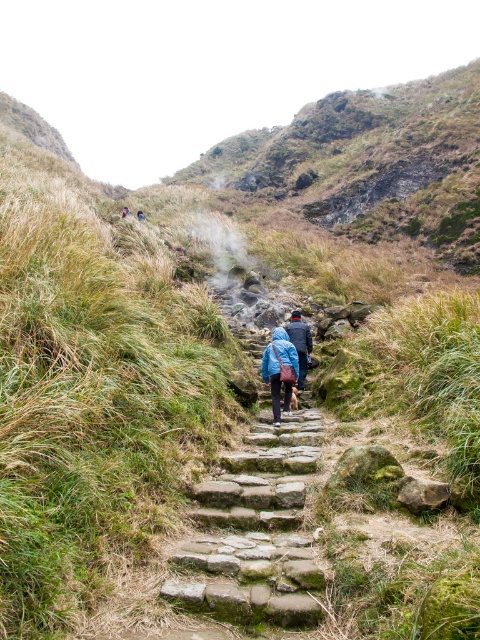
Does point (289, 573) come closer to viewer compared to point (294, 378)?

Yes, it is in front of point (294, 378).

Does point (289, 586) come behind point (305, 337)?

No.

Does point (301, 468) come closer to viewer compared to point (282, 348)?

Yes, point (301, 468) is closer to viewer.

Where is `green mossy stone stairs at center`? The image size is (480, 640). green mossy stone stairs at center is located at coordinates (255, 532).

Consider the image. Who is more distant from viewer, (203,520) or (303,326)?

Positioned behind is point (303,326).

This screenshot has width=480, height=640. Describe the element at coordinates (255, 532) in the screenshot. I see `green mossy stone stairs at center` at that location.

Where is `green mossy stone stairs at center`? This screenshot has width=480, height=640. green mossy stone stairs at center is located at coordinates (255, 532).

Locate an element on the screen. green mossy stone stairs at center is located at coordinates (255, 532).

Is point (291, 344) farther from camera compared to point (300, 358)?

That is False.

Where is `blue fabric bag at center`? blue fabric bag at center is located at coordinates tap(285, 358).